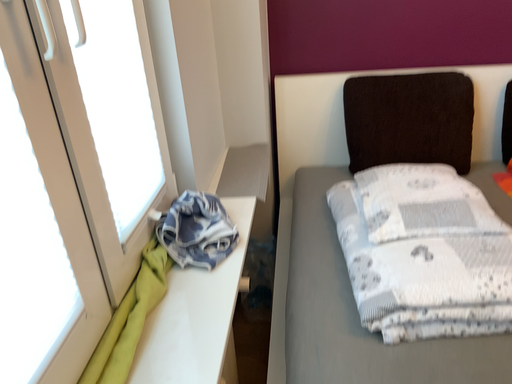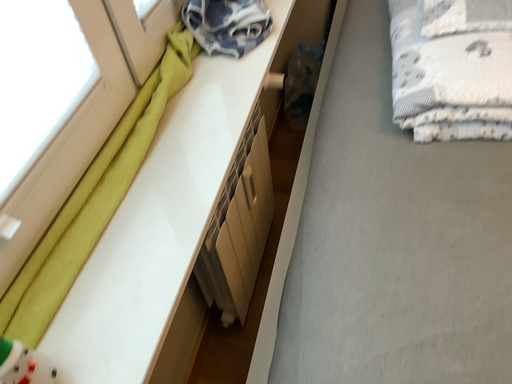
Question: Which way did the camera rotate in the video?

Choices:
 (A) rotated downward
 (B) rotated upward

Answer: (A)